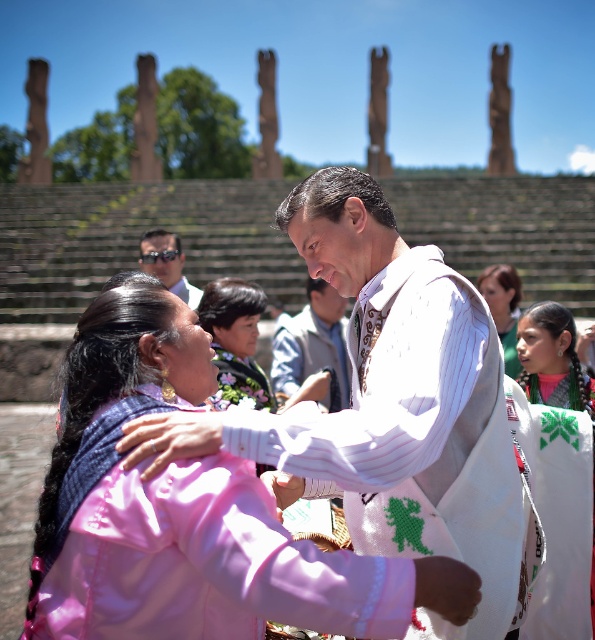
You are standing at the point with coordinates point [502,278] and want to walk towards the point with coordinates point [271,406]. Based on the scene description, will you be moving towards the foreground or background of the image?

Since point [271,406] is in front of point [502,278], moving from point [502,278] towards point [271,406] would mean moving towards the foreground of the image.

You are a fashion designer observing the two outfits in the scene. The embroidered fabric blouse at center and the matte green dress at center are both part of a collection. Which one is positioned lower on the model?

The embroidered fabric blouse at center is located below the matte green dress at center, so it is positioned lower on the model.

You are organizing a photo shoot and need to ensure that the pink fabric at center and the white embroidered blouse at center are visible in the frame. Based on their sizes, which object would require more horizontal space in the camera frame?

The pink fabric at center might be wider than the white embroidered blouse at center, so it would require more horizontal space in the camera frame.